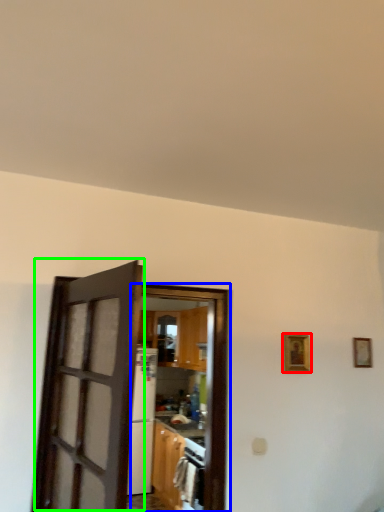
Question: Which object is positioned closest to picture frame (highlighted by a red box)? Select from door (highlighted by a blue box) and door (highlighted by a green box).

Choices:
 (A) door
 (B) door

Answer: (A)